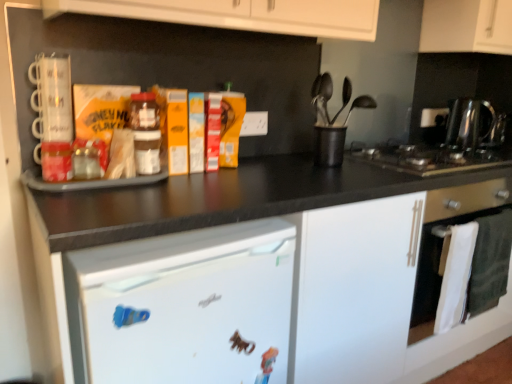
I want to click on vacant position to the left of black plastic utensil holder at center, so click(271, 159).